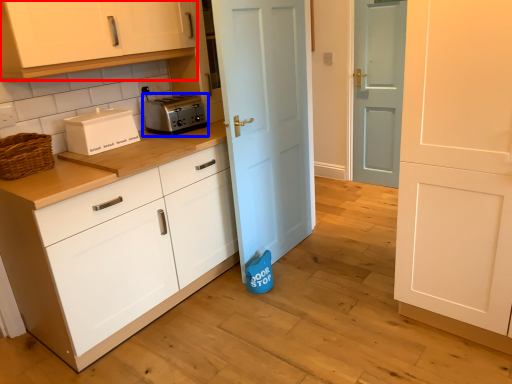
Question: Which object is closer to the camera taking this photo, cabinetry (highlighted by a red box) or toaster (highlighted by a blue box)?

Choices:
 (A) cabinetry
 (B) toaster

Answer: (A)